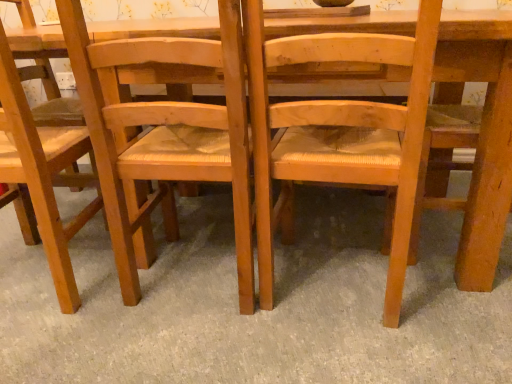
At what (x,y) coordinates should I click in order to perform the action: click on free location in front of wooden woven seat at center, the 2th chair when ordered from right to left. Please return your answer as a coordinate pair (x, y). This screenshot has height=384, width=512. Looking at the image, I should click on [x=190, y=350].